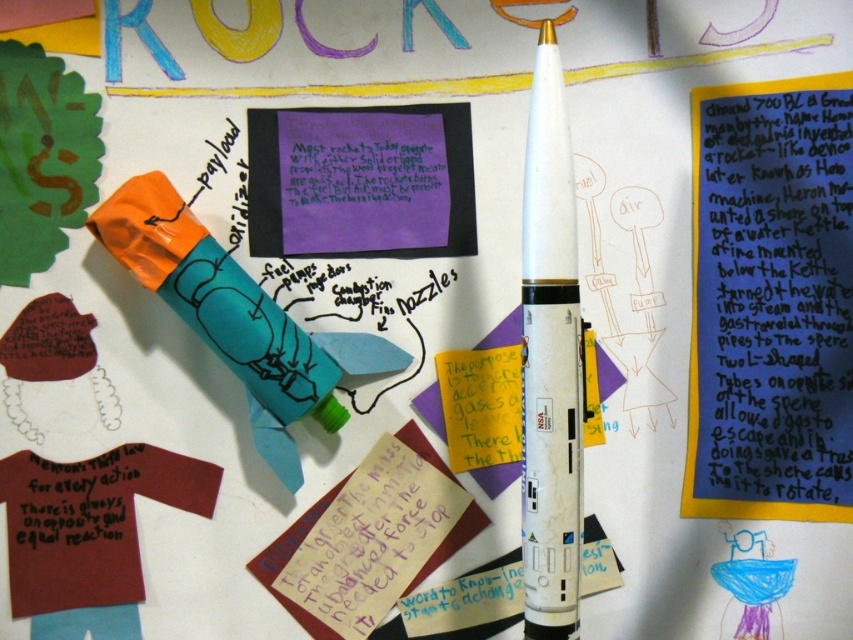
Question: Which object appears farthest from the camera in this image?

Choices:
 (A) matte purple paper at upper right
 (B) white matte rocket at center

Answer: (A)

Question: Which of the following is the closest to the observer?

Choices:
 (A) (567, 312)
 (B) (772, 244)

Answer: (A)

Question: Is matte purple paper at upper right closer to camera compared to white matte rocket at center?

Choices:
 (A) no
 (B) yes

Answer: (A)

Question: Can you confirm if matte purple paper at upper right is smaller than white matte rocket at center?

Choices:
 (A) yes
 (B) no

Answer: (B)

Question: Observing the image, what is the correct spatial positioning of matte purple paper at upper right in reference to white matte rocket at center?

Choices:
 (A) right
 (B) left

Answer: (A)